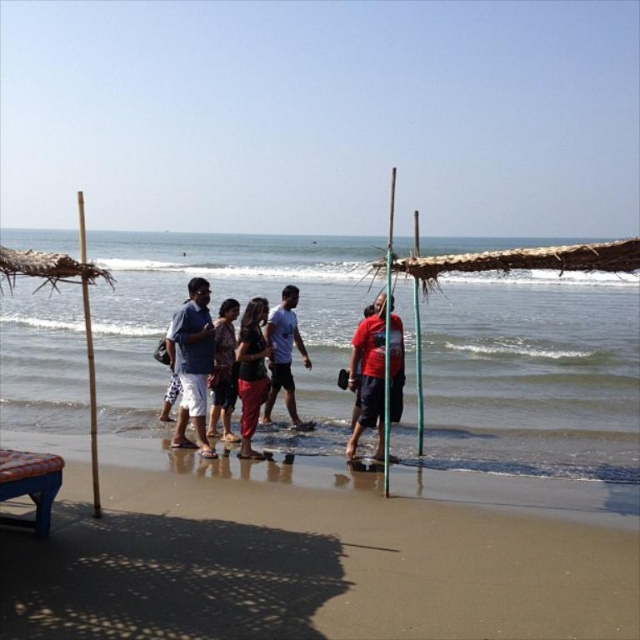
Question: Among these points, which one is nearest to the camera?

Choices:
 (A) (376, 401)
 (B) (234, 385)
 (C) (97, 504)

Answer: (C)

Question: Is the position of bamboo pole at left less distant than that of green bamboo pole at center?

Choices:
 (A) no
 (B) yes

Answer: (B)

Question: From the image, what is the correct spatial relationship of matte black pants at center in relation to light blue cotton shirt at center?

Choices:
 (A) right
 (B) left

Answer: (B)

Question: Estimate the real-world distances between objects in this image. Which object is closer to the blue cotton shirt at center?

Choices:
 (A) green bamboo pole at center
 (B) matte black pants at center
 (C) light blue cotton shirt at center
 (D) green plastic pole at center

Answer: (B)

Question: Which point is closer to the camera taking this photo?

Choices:
 (A) (321, 422)
 (B) (83, 305)

Answer: (A)

Question: Does red matte shirt at center appear over light blue cotton shirt at center?

Choices:
 (A) no
 (B) yes

Answer: (B)